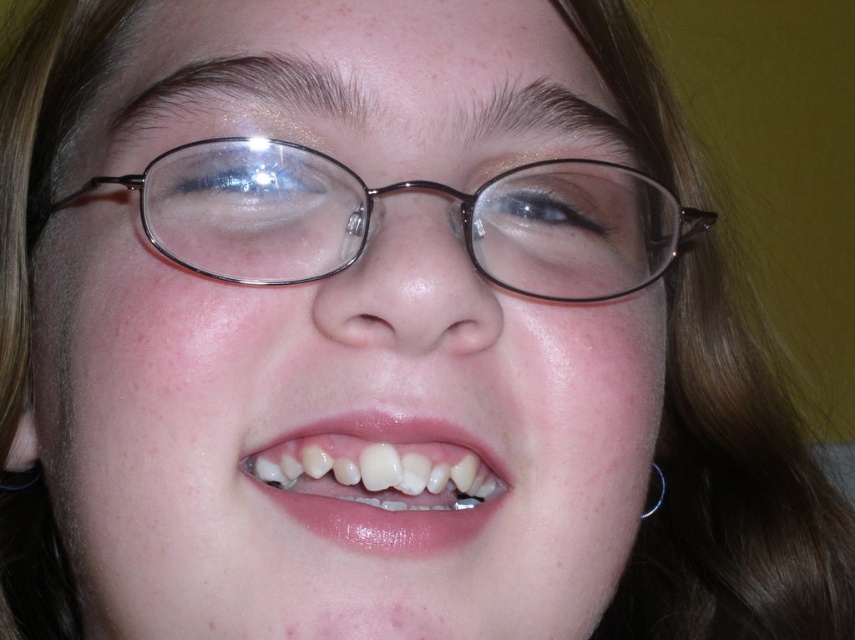
You are a dentist examining a patient. You need to clean the metallic frame glasses at center and the translucent plastic teeth at center. Given that your tools require a minimum of 3 inches of space between objects to function safely, will you be able to use them on both objects simultaneously?

The distance between the metallic frame glasses at center and the translucent plastic teeth at center is 2.80 inches, which is less than the required 3 inches. Therefore, the tools cannot be used safely on both objects simultaneously.

You are trying to locate the metallic frame glasses at center in the image. According to the coordinates provided, where exactly would you find them?

The metallic frame glasses at center are located at point (x=404, y=193).

You are a dentist examining a patient. You need to determine the position of the metallic frame glasses at center relative to the translucent plastic teeth at center. Based on the scene, which object is located to the right?

The metallic frame glasses at center is positioned on the right side of translucent plastic teeth at center, so the metallic frame glasses at center is located to the right.